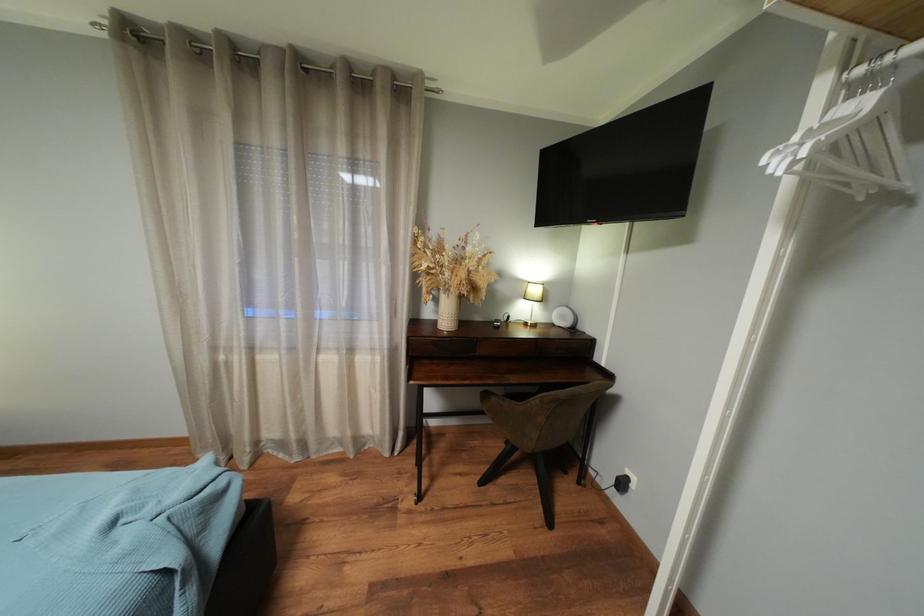
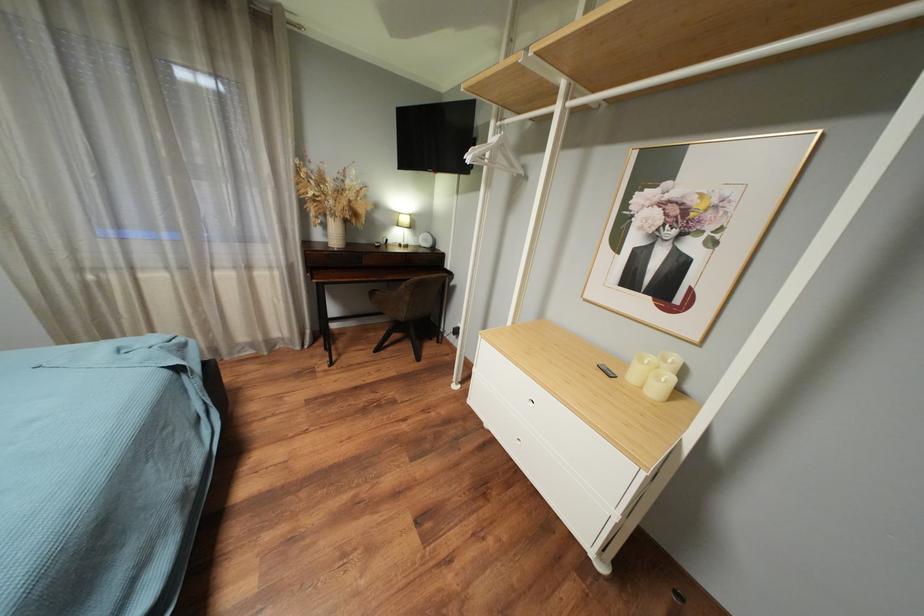
Question: What movement of the cameraman would produce the second image?

Choices:
 (A) Left
 (B) Right
 (C) Forward
 (D) Backward

Answer: (D)